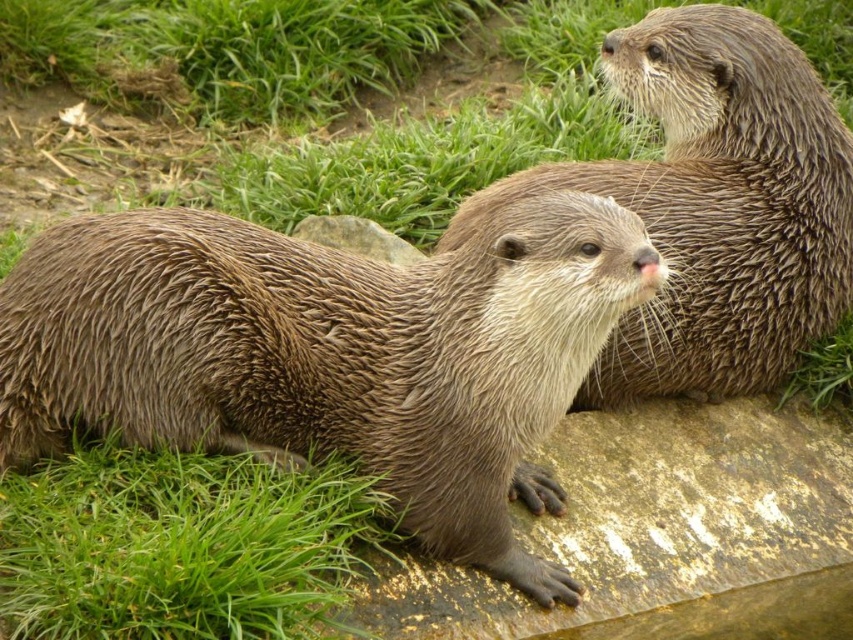
You are a photographer trying to capture a clear shot of the brown fur otter at upper right without the green grass at upper left blocking it. Based on their positions, is this possible?

The brown fur otter at upper right is in front of the green grass at upper left, so it is blocking the grass. To capture a clear shot of the otter without the grass, you would need to position yourself so that the otter is not overlapping with the grass in the frame.

You are observing two points in the image of the otters. Which point is closer to you, point (299, 269) or point (25, 548)?

Point (299, 269) is further to the viewer than point (25, 548), so point (25, 548) is closer to you.